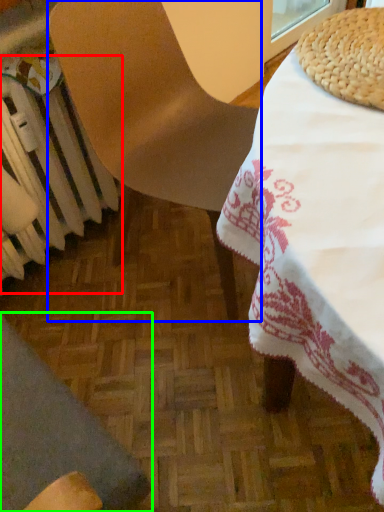
Question: Which object is positioned farthest from radiator (highlighted by a red box)? Select from chair (highlighted by a blue box) and chair (highlighted by a green box).

Choices:
 (A) chair
 (B) chair

Answer: (B)